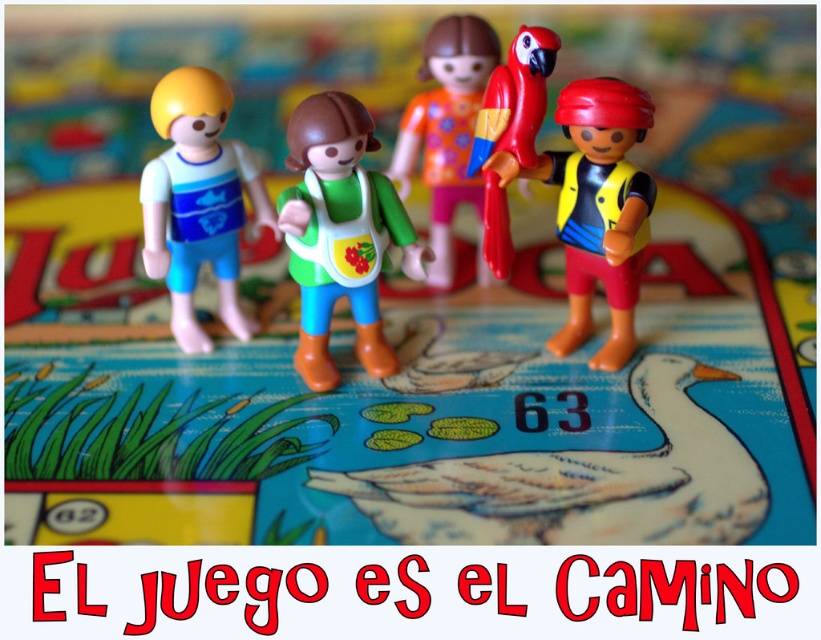
Question: Which of these objects is positioned farthest from the matte plastic doll at center?

Choices:
 (A) shiny plastic parrot at center
 (B) green matte vest at center
 (C) matte plastic figure at left
 (D) yellow matte vest at center

Answer: (C)

Question: Is yellow matte vest at center further to camera compared to shiny plastic parrot at center?

Choices:
 (A) yes
 (B) no

Answer: (B)

Question: Which object is farther from the camera taking this photo?

Choices:
 (A) shiny plastic parrot at center
 (B) yellow matte vest at center

Answer: (A)

Question: Can you confirm if yellow matte vest at center is bigger than matte plastic figure at left?

Choices:
 (A) yes
 (B) no

Answer: (A)

Question: Can you confirm if green matte vest at center is smaller than matte plastic figure at left?

Choices:
 (A) no
 (B) yes

Answer: (B)

Question: Which object is positioned closest to the green matte vest at center?

Choices:
 (A) shiny plastic parrot at center
 (B) yellow matte vest at center
 (C) matte plastic doll at center

Answer: (A)